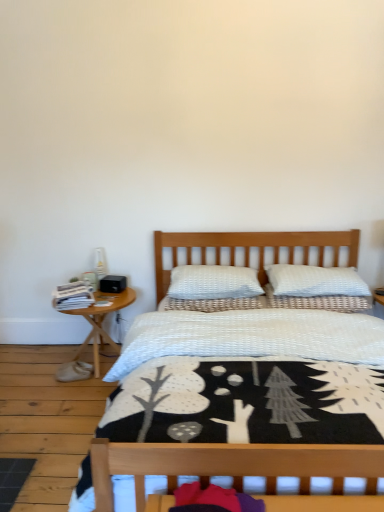
Question: Considering their positions, is woodennightstand at left located in front of or behind white textured pillow at center, which is the second pillow in left-to-right order?

Choices:
 (A) front
 (B) behind

Answer: (A)

Question: Considering the relative positions of woodennightstand at left and white textured pillow at center, which is the second pillow in left-to-right order, in the image provided, is woodennightstand at left to the left or to the right of white textured pillow at center, which is the second pillow in left-to-right order,?

Choices:
 (A) left
 (B) right

Answer: (A)

Question: Based on their relative distances, which object is nearer to the white textured bed at center?

Choices:
 (A) white textured pillow at center, the first pillow when ordered from left to right
 (B) white textured pillow at center, the 2th pillow from the right
 (C) white textured pillow at upper center, which is counted as the 1th pillow, starting from the right
 (D) woodennightstand at left

Answer: (B)

Question: Which is nearer to the white textured bed at center?

Choices:
 (A) woodennightstand at left
 (B) white textured pillow at center, the 2th pillow from the right
 (C) white textured pillow at upper center, which is counted as the 1th pillow, starting from the right
 (D) white textured pillow at center, the first pillow when ordered from left to right

Answer: (B)